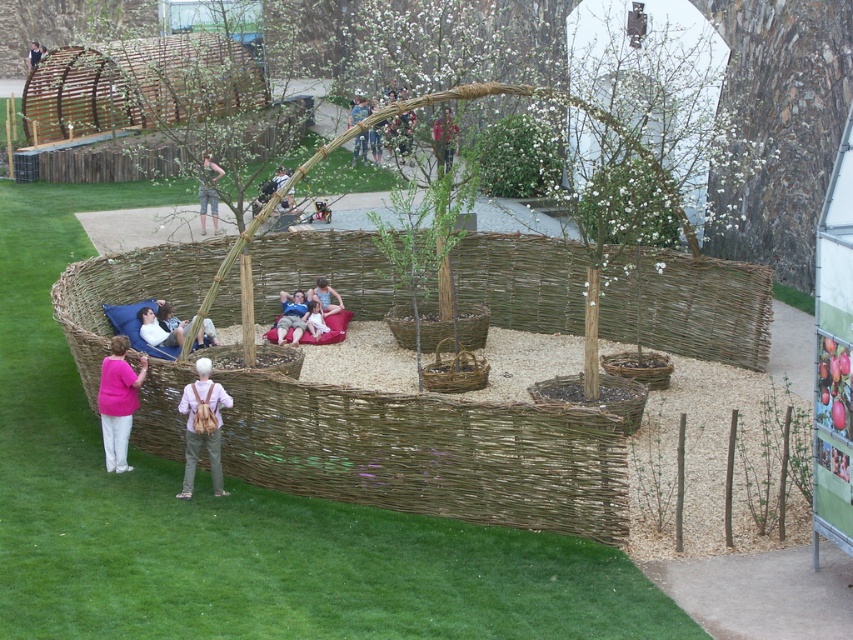
Question: Which point appears farthest from the camera in this image?

Choices:
 (A) (x=326, y=289)
 (B) (x=664, y=385)

Answer: (A)

Question: From the image, what is the correct spatial relationship of woven brown basket at lower right in relation to light pink fabric cushion at center?

Choices:
 (A) left
 (B) right

Answer: (B)

Question: From the image, what is the correct spatial relationship of woven brown basket at lower right in relation to matte red beanbag at center?

Choices:
 (A) above
 (B) below

Answer: (B)

Question: Considering the real-world distances, which object is closest to the woven brown basket at center?

Choices:
 (A) light brown woven basket at center
 (B) brown woven basket at center
 (C) white cotton shirt at center
 (D) matte red beanbag at center

Answer: (B)

Question: Among these objects, which one is nearest to the camera?

Choices:
 (A) denim shorts at center
 (B) matte black jacket at upper center
 (C) light pink fabric cushion at center

Answer: (B)

Question: Is white cotton shirt at center smaller than light pink fabric cushion at center?

Choices:
 (A) yes
 (B) no

Answer: (B)